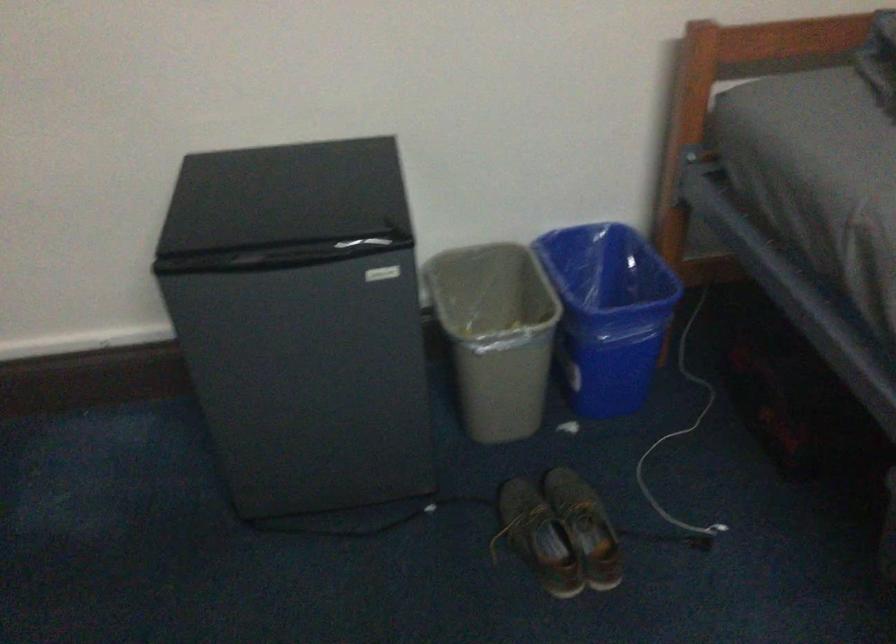
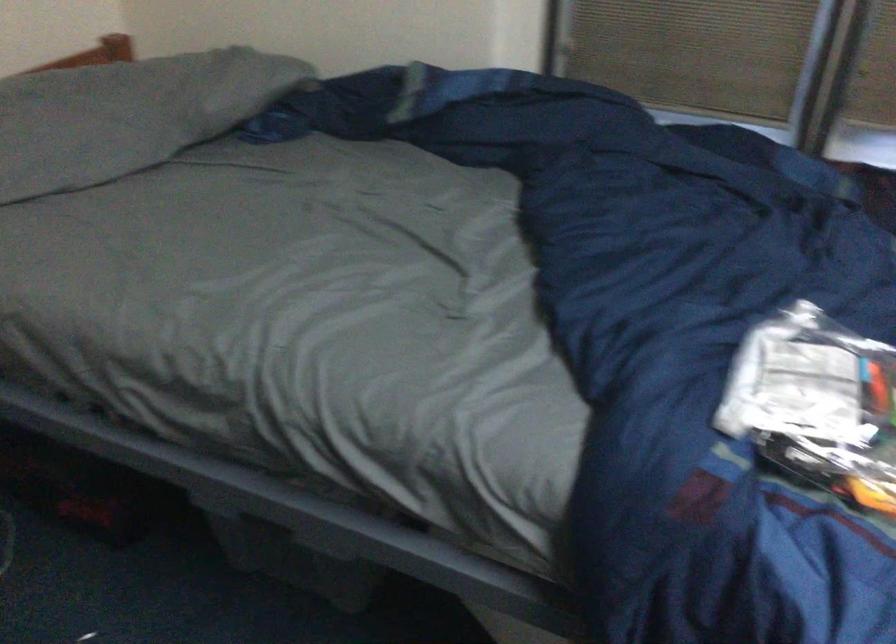
Question: The images are taken continuously from a first-person perspective. In which direction is your viewpoint rotating?

Choices:
 (A) Left
 (B) Right
 (C) Up
 (D) Down

Answer: (B)